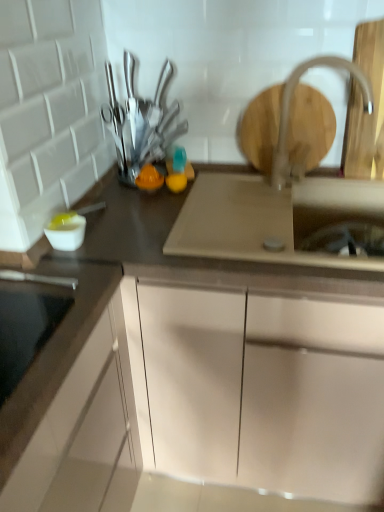
Describe the element at coordinates (271, 218) in the screenshot. Image resolution: width=384 pixels, height=512 pixels. I see `satin silver sink at center` at that location.

What is the approximate height of satin nickel faucet at upper right?

It is 13.99 inches.

Where is `satin nickel faucet at upper right`? The height and width of the screenshot is (512, 384). satin nickel faucet at upper right is located at coordinates (289, 106).

This screenshot has height=512, width=384. Identify the location of white matte cabinet at center. (199, 379).

You are a GUI agent. You are given a task and a screenshot of the screen. Output one action in this format:
    pyautogui.click(x=<x>, y=<y>)
    Task: Click on the metallic silver knives at upper center
    The width and height of the screenshot is (384, 512).
    Given the screenshot: What is the action you would take?
    pyautogui.click(x=140, y=122)

Measure the distance between metallic silver knives at upper center and camera.

metallic silver knives at upper center is 4.01 feet from camera.

Locate an element on the screen. satin silver sink at center is located at coordinates (271, 218).

Considering the positions of objects satin silver sink at center and white matte cabinet at center in the image provided, who is behind, satin silver sink at center or white matte cabinet at center?

Positioned behind is satin silver sink at center.

Considering the relative sizes of satin silver sink at center and white matte cabinet at center in the image provided, is satin silver sink at center bigger than white matte cabinet at center?

Incorrect, satin silver sink at center is not larger than white matte cabinet at center.

Considering the points (375, 192) and (199, 383), which point is behind, point (375, 192) or point (199, 383)?

Point (375, 192)

Locate an element on the screen. Image resolution: width=384 pixels, height=512 pixels. sink above the white matte cabinet at center (from a real-world perspective) is located at coordinates (271, 218).

Considering the sizes of objects satin silver sink at center and satin nickel faucet at upper right in the image provided, who is bigger, satin silver sink at center or satin nickel faucet at upper right?

Bigger between the two is satin silver sink at center.

Locate an element on the screen. The image size is (384, 512). sink lying on the left of satin nickel faucet at upper right is located at coordinates (271, 218).

From a real-world perspective, who is located higher, satin silver sink at center or satin nickel faucet at upper right?

satin nickel faucet at upper right, from a real-world perspective.

Visually, is satin silver sink at center positioned to the left or to the right of metallic silver knives at upper center?

From the image, it's evident that satin silver sink at center is to the right of metallic silver knives at upper center.

Considering the relative sizes of satin silver sink at center and metallic silver knives at upper center in the image provided, is satin silver sink at center thinner than metallic silver knives at upper center?

Incorrect, the width of satin silver sink at center is not less than that of metallic silver knives at upper center.

Considering the sizes of objects satin silver sink at center and metallic silver knives at upper center in the image provided, who is shorter, satin silver sink at center or metallic silver knives at upper center?

Standing shorter between the two is satin silver sink at center.

Looking at this image, from a real-world perspective, is satin silver sink at center physically located above or below metallic silver knives at upper center?

satin silver sink at center is below metallic silver knives at upper center.

Considering the positions of objects metallic silver knives at upper center and satin silver sink at center in the image provided, who is more to the left, metallic silver knives at upper center or satin silver sink at center?

metallic silver knives at upper center is more to the left.

From the image's perspective, is metallic silver knives at upper center over satin silver sink at center?

Correct, metallic silver knives at upper center appears higher than satin silver sink at center in the image.

Are metallic silver knives at upper center and satin silver sink at center located far from each other?

metallic silver knives at upper center is actually quite close to satin silver sink at center.

What's the angular difference between metallic silver knives at upper center and satin silver sink at center's facing directions?

The angular difference between metallic silver knives at upper center and satin silver sink at center is 0.00218 degrees.

Which of these two, satin nickel faucet at upper right or white matte cabinet at center, is smaller?

satin nickel faucet at upper right is smaller.

Measure the distance from satin nickel faucet at upper right to white matte cabinet at center.

satin nickel faucet at upper right and white matte cabinet at center are 24.25 inches apart from each other.

In the scene shown: Which is in front, satin nickel faucet at upper right or white matte cabinet at center?

white matte cabinet at center.

In the scene shown: How many degrees apart are the facing directions of satin nickel faucet at upper right and white matte cabinet at center?

64 degrees.

Is white matte cabinet at center taller or shorter than satin nickel faucet at upper right?

Clearly, white matte cabinet at center is taller compared to satin nickel faucet at upper right.

From a real-world perspective, who is located lower, white matte cabinet at center or satin nickel faucet at upper right?

white matte cabinet at center.

Can you confirm if white matte cabinet at center is bigger than satin nickel faucet at upper right?

Indeed, white matte cabinet at center has a larger size compared to satin nickel faucet at upper right.

Does white matte cabinet at center lie behind satin nickel faucet at upper right?

No.

Who is taller, white matte cabinet at center or satin silver sink at center?

Standing taller between the two is white matte cabinet at center.

Considering their positions, is white matte cabinet at center located in front of or behind satin silver sink at center?

Clearly, white matte cabinet at center is in front of satin silver sink at center.

Can you confirm if white matte cabinet at center is positioned to the right of satin silver sink at center?

No, white matte cabinet at center is not to the right of satin silver sink at center.

Is point (336, 380) positioned after point (302, 258)?

Yes, point (336, 380) is behind point (302, 258).

Locate an element on the screen. This screenshot has width=384, height=512. cabinetry on the left of satin silver sink at center is located at coordinates (199, 379).

Where is `tap positioned vertically above the satin silver sink at center (from a real-world perspective)`? This screenshot has width=384, height=512. tap positioned vertically above the satin silver sink at center (from a real-world perspective) is located at coordinates (x=289, y=106).

Which object lies nearer to the anchor point satin silver sink at center, metallic silver knives at upper center or white matte cabinet at center?

white matte cabinet at center.

Estimate the real-world distances between objects in this image. Which object is closer to satin nickel faucet at upper right, metallic silver knives at upper center or white matte cabinet at center?

Based on the image, metallic silver knives at upper center appears to be nearer to satin nickel faucet at upper right.

Which object lies further to the anchor point metallic silver knives at upper center, satin silver sink at center or white matte cabinet at center?

The object further to metallic silver knives at upper center is white matte cabinet at center.

From the image, which object appears to be nearer to metallic silver knives at upper center, white matte cabinet at center or satin silver sink at center?

Based on the image, satin silver sink at center appears to be nearer to metallic silver knives at upper center.

Looking at the image, which one is located closer to satin nickel faucet at upper right, white matte cabinet at center or metallic silver knives at upper center?

metallic silver knives at upper center is closer to satin nickel faucet at upper right.

Looking at the image, which one is located further to white matte cabinet at center, metallic silver knives at upper center or satin silver sink at center?

Among the two, metallic silver knives at upper center is located further to white matte cabinet at center.

When comparing their distances from satin nickel faucet at upper right, does satin silver sink at center or white matte cabinet at center seem further?

white matte cabinet at center is positioned further to the anchor satin nickel faucet at upper right.

From the image, which object appears to be farther from metallic silver knives at upper center, satin nickel faucet at upper right or satin silver sink at center?

Among the two, satin nickel faucet at upper right is located further to metallic silver knives at upper center.

At what (x,y) coordinates should I click in order to perform the action: click on sink between metallic silver knives at upper center and satin nickel faucet at upper right in the horizontal direction. Please return your answer as a coordinate pair (x, y). Looking at the image, I should click on (271, 218).

At what (x,y) coordinates should I click in order to perform the action: click on tap between metallic silver knives at upper center and white matte cabinet at center in the up-down direction. Please return your answer as a coordinate pair (x, y). This screenshot has height=512, width=384. Looking at the image, I should click on (289, 106).

At what (x,y) coordinates should I click in order to perform the action: click on sink between metallic silver knives at upper center and white matte cabinet at center vertically. Please return your answer as a coordinate pair (x, y). This screenshot has height=512, width=384. Looking at the image, I should click on (271, 218).

Find the location of a particular element. sink between satin nickel faucet at upper right and white matte cabinet at center in the vertical direction is located at coordinates (271, 218).